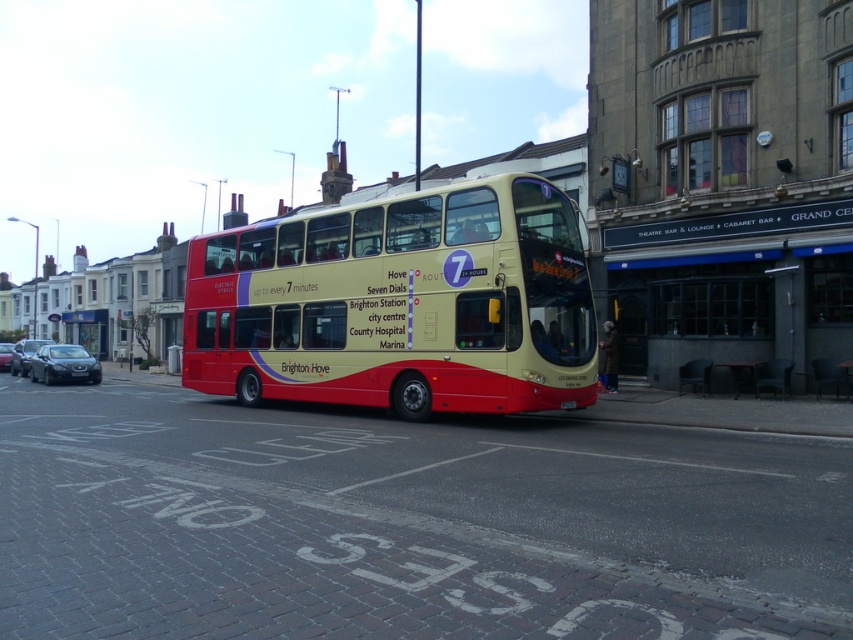
You are a delivery person trying to park your 1.8 meters tall delivery box next to the matte red bus at center and the shiny black sedan at center. Which vehicle should you place the box next to so it doesn

The matte red bus at center is taller than the shiny black sedan at center, so the delivery box should be placed next to the shiny black sedan at center to ensure it doesn

You are a delivery person needing to park your motorcycle between the matte red bus at center and the shiny black sedan at center. Can you fit your motorcycle, which is 1.5 meters wide, in the space between them?

The matte red bus at center is wider than the shiny black sedan at center. However, the exact distance between them isn not specified in the provided information. Without knowing the space between the two vehicles, it is impossible to determine if the motorcycle will fit.